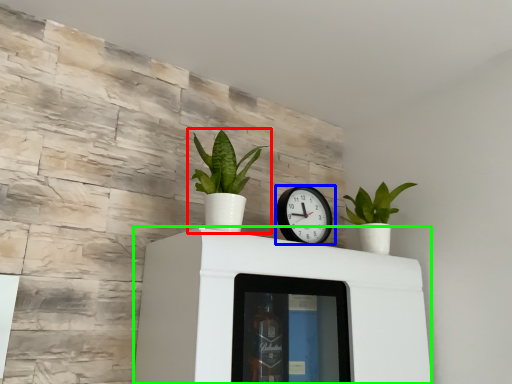
Question: Considering the real-world distances, which object is farthest from houseplant (highlighted by a red box)? wall clock (highlighted by a blue box) or furniture (highlighted by a green box)?

Choices:
 (A) wall clock
 (B) furniture

Answer: (B)